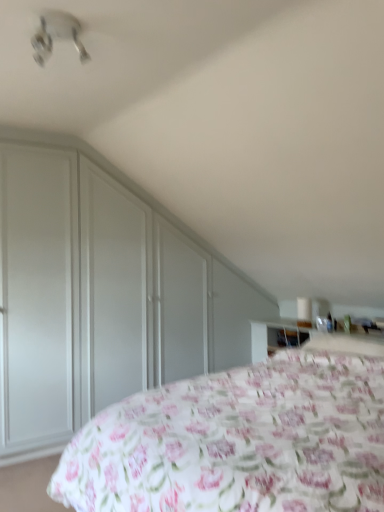
Identify the location of matte white dresser at left. The image size is (384, 512). (101, 296).

Where is `fan lying on the left of floral fabric bed at lower right`? fan lying on the left of floral fabric bed at lower right is located at coordinates (56, 35).

Which is closer to the camera, (35, 61) or (366, 426)?

Point (35, 61) is farther from the camera than point (366, 426).

Between white plastic fan at upper left and floral fabric bed at lower right, which one appears on the left side from the viewer's perspective?

white plastic fan at upper left.

Is white plastic fan at upper left spatially inside floral fabric bed at lower right, or outside of it?

white plastic fan at upper left is not enclosed by floral fabric bed at lower right.

From a real-world perspective, is matte white dresser at left on floral fabric bed at lower right?

Indeed, from a real-world perspective, matte white dresser at left stands above floral fabric bed at lower right.

Considering the sizes of objects matte white dresser at left and floral fabric bed at lower right in the image provided, who is taller, matte white dresser at left or floral fabric bed at lower right?

With more height is matte white dresser at left.

Considering the sizes of objects matte white dresser at left and floral fabric bed at lower right in the image provided, who is bigger, matte white dresser at left or floral fabric bed at lower right?

With larger size is floral fabric bed at lower right.

Find the location of `bed on the right side of matte white dresser at left`. bed on the right side of matte white dresser at left is located at coordinates (240, 440).

Between floral fabric bed at lower right and matte white dresser at left, which one has less height?

With less height is floral fabric bed at lower right.

Image resolution: width=384 pixels, height=512 pixels. In the image, there is a matte white dresser at left. Find the location of `bed below it (from a real-world perspective)`. bed below it (from a real-world perspective) is located at coordinates (240, 440).

From the image's perspective, which is above, floral fabric bed at lower right or matte white dresser at left?

matte white dresser at left.

Which object is more forward, floral fabric bed at lower right or matte white dresser at left?

floral fabric bed at lower right is closer to the camera.

Considering the relative positions of floral fabric bed at lower right and white plastic fan at upper left in the image provided, is floral fabric bed at lower right to the right of white plastic fan at upper left from the viewer's perspective?

Correct, you'll find floral fabric bed at lower right to the right of white plastic fan at upper left.

How much distance is there between floral fabric bed at lower right and white plastic fan at upper left?

floral fabric bed at lower right is 6.05 feet away from white plastic fan at upper left.

Is floral fabric bed at lower right oriented away from white plastic fan at upper left?

No, floral fabric bed at lower right is not facing the opposite direction of white plastic fan at upper left.

Which object is closer to the camera, floral fabric bed at lower right or white plastic fan at upper left?

floral fabric bed at lower right is more forward.

The height and width of the screenshot is (512, 384). I want to click on fan in front of the matte white dresser at left, so click(56, 35).

Is matte white dresser at left further to camera compared to white plastic fan at upper left?

Yes, it is.

Is matte white dresser at left oriented towards white plastic fan at upper left?

Yes, matte white dresser at left is facing white plastic fan at upper left.

Who is shorter, matte white dresser at left or white plastic fan at upper left?

With less height is white plastic fan at upper left.

Which object is thinner, white plastic fan at upper left or matte white dresser at left?

matte white dresser at left is thinner.

Does white plastic fan at upper left have a smaller size compared to matte white dresser at left?

Yes, white plastic fan at upper left is smaller than matte white dresser at left.

From a real-world perspective, is white plastic fan at upper left positioned above or below matte white dresser at left?

white plastic fan at upper left is situated higher than matte white dresser at left in the real world.

Locate an element on the screen. fan above the floral fabric bed at lower right (from a real-world perspective) is located at coordinates (56, 35).

The width and height of the screenshot is (384, 512). What are the coordinates of `bed below the matte white dresser at left (from the image's perspective)` in the screenshot? It's located at (240, 440).

From the image, which object appears to be farther from white plastic fan at upper left, floral fabric bed at lower right or matte white dresser at left?

Among the two, floral fabric bed at lower right is located further to white plastic fan at upper left.

Looking at the image, which one is located closer to matte white dresser at left, white plastic fan at upper left or floral fabric bed at lower right?

floral fabric bed at lower right.

Considering their positions, is matte white dresser at left positioned further to white plastic fan at upper left than floral fabric bed at lower right?

floral fabric bed at lower right is further to white plastic fan at upper left.

From the image, which object appears to be nearer to matte white dresser at left, floral fabric bed at lower right or white plastic fan at upper left?

floral fabric bed at lower right is positioned closer to the anchor matte white dresser at left.

Estimate the real-world distances between objects in this image. Which object is further from floral fabric bed at lower right, white plastic fan at upper left or matte white dresser at left?

white plastic fan at upper left is positioned further to the anchor floral fabric bed at lower right.

When comparing their distances from floral fabric bed at lower right, does matte white dresser at left or white plastic fan at upper left seem further?

The object further to floral fabric bed at lower right is white plastic fan at upper left.

You are a GUI agent. You are given a task and a screenshot of the screen. Output one action in this format:
    pyautogui.click(x=<x>, y=<y>)
    Task: Click on the fan positioned between floral fabric bed at lower right and matte white dresser at left from near to far
    
    Given the screenshot: What is the action you would take?
    pyautogui.click(x=56, y=35)